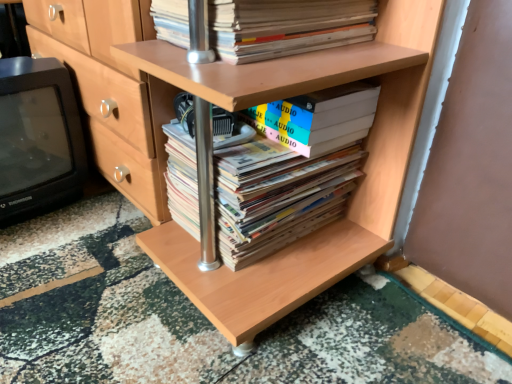
Question: Is black plastic television at left thinner than white matte book at center, the 2th book when ordered from top to bottom?

Choices:
 (A) yes
 (B) no

Answer: (B)

Question: Is the position of black plastic television at left more distant than that of white matte book at center, the second book from the bottom?

Choices:
 (A) no
 (B) yes

Answer: (B)

Question: Can you confirm if black plastic television at left is wider than white matte book at center, the second book from the bottom?

Choices:
 (A) yes
 (B) no

Answer: (A)

Question: From the image's perspective, does black plastic television at left appear higher than white matte book at center, the second book from the bottom?

Choices:
 (A) yes
 (B) no

Answer: (A)

Question: Would you say black plastic television at left contains white matte book at center, the 2th book when ordered from top to bottom?

Choices:
 (A) yes
 (B) no

Answer: (B)

Question: Can you confirm if black plastic television at left is taller than white matte book at center, the 2th book when ordered from top to bottom?

Choices:
 (A) no
 (B) yes

Answer: (B)

Question: From the image's perspective, is white matte book at center, the 2th book when ordered from top to bottom, above hardcover books at center, which is the 3th book from top to bottom?

Choices:
 (A) no
 (B) yes

Answer: (B)

Question: Can you confirm if white matte book at center, the 2th book when ordered from top to bottom, is taller than hardcover books at center, which is the 3th book from top to bottom?

Choices:
 (A) no
 (B) yes

Answer: (A)

Question: From a real-world perspective, is white matte book at center, the second book from the bottom, positioned under hardcover books at center, which is the 3th book from top to bottom, based on gravity?

Choices:
 (A) yes
 (B) no

Answer: (B)

Question: Is white matte book at center, the second book from the bottom, far from hardcover books at center, which is the 3th book from top to bottom?

Choices:
 (A) yes
 (B) no

Answer: (B)

Question: Considering the relative sizes of white matte book at center, the second book from the bottom, and hardcover books at center, which is the 3th book from top to bottom, in the image provided, is white matte book at center, the second book from the bottom, bigger than hardcover books at center, which is the 3th book from top to bottom,?

Choices:
 (A) no
 (B) yes

Answer: (A)

Question: Does white matte book at center, the second book from the bottom, appear on the right side of hardcover books at center, which is the 3th book from top to bottom?

Choices:
 (A) no
 (B) yes

Answer: (B)

Question: Could you tell me if hardcover books at center, the 1th book when ordered from bottom to top, is facing white matte book at center, the second book from the bottom?

Choices:
 (A) no
 (B) yes

Answer: (A)